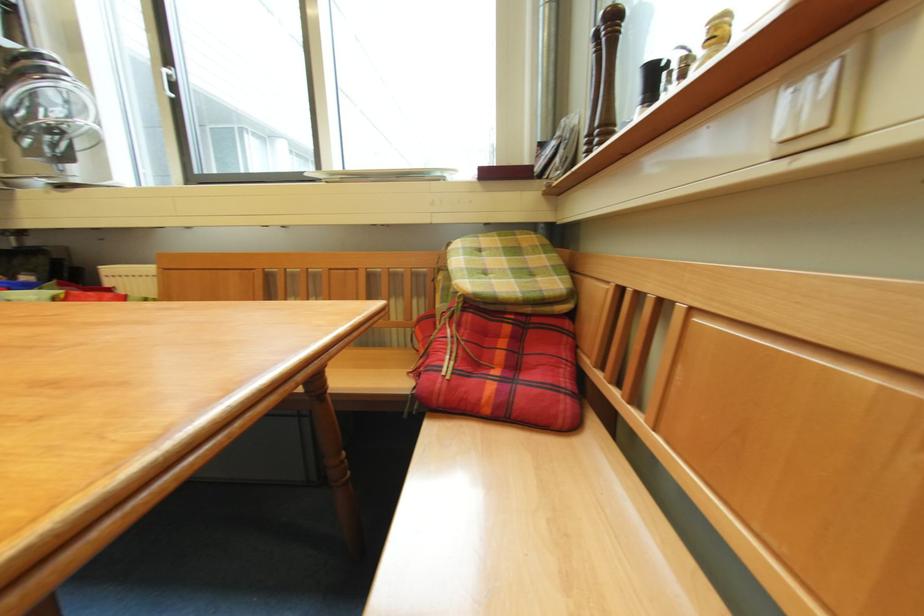
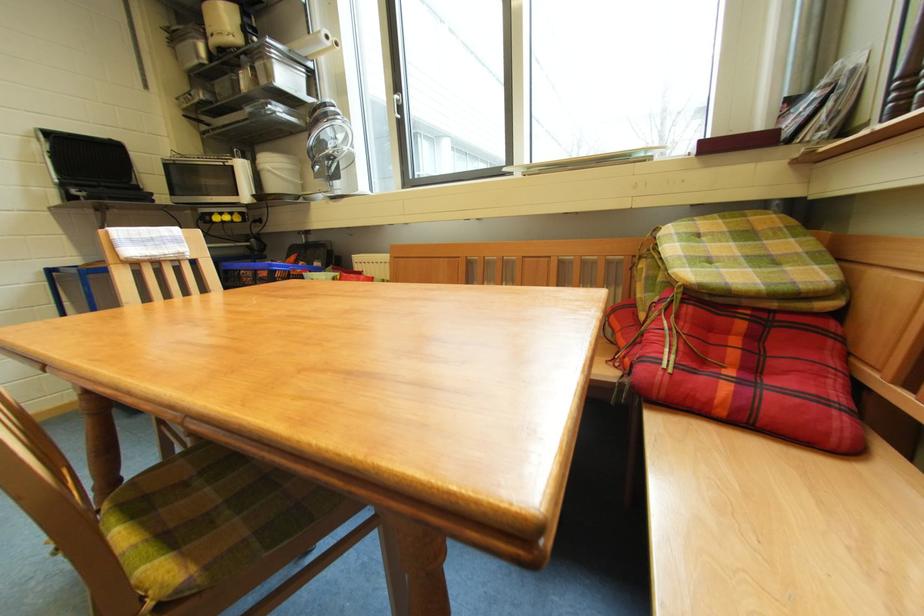
In the second image, find the point that corresponds to point 502,237 in the first image.

(723, 219)